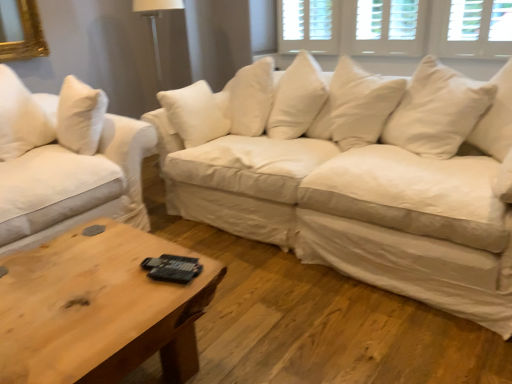
Question: Should I look upward or downward to see white cotton couch at center, which is counted as the 1th studio couch, starting from the right?

Choices:
 (A) down
 (B) up

Answer: (B)

Question: From a real-world perspective, is white cotton couch at left, which is counted as the 2th studio couch, starting from the right, located higher than white cotton couch at center, the 2th studio couch when ordered from left to right?

Choices:
 (A) yes
 (B) no

Answer: (A)

Question: Is white cotton couch at left, which is counted as the 2th studio couch, starting from the right, taller than white cotton couch at center, which is counted as the 1th studio couch, starting from the right?

Choices:
 (A) yes
 (B) no

Answer: (A)

Question: Is there a large distance between white cotton couch at left, the 1th studio couch in the left-to-right sequence, and white cotton couch at center, which is counted as the 1th studio couch, starting from the right?

Choices:
 (A) yes
 (B) no

Answer: (B)

Question: Does white cotton couch at left, which is counted as the 2th studio couch, starting from the right, turn towards white cotton couch at center, which is counted as the 1th studio couch, starting from the right?

Choices:
 (A) no
 (B) yes

Answer: (A)

Question: From the image's perspective, would you say white cotton couch at left, the 1th studio couch in the left-to-right sequence, is shown under white cotton couch at center, which is counted as the 1th studio couch, starting from the right?

Choices:
 (A) yes
 (B) no

Answer: (A)

Question: Does white cotton couch at left, the 1th studio couch in the left-to-right sequence, touch white cotton couch at center, which is counted as the 1th studio couch, starting from the right?

Choices:
 (A) no
 (B) yes

Answer: (A)

Question: Can you confirm if white cotton couch at center, which is counted as the 1th studio couch, starting from the right, is smaller than white cotton couch at left, which is counted as the 2th studio couch, starting from the right?

Choices:
 (A) no
 (B) yes

Answer: (A)

Question: From a real-world perspective, is white cotton couch at center, the 2th studio couch when ordered from left to right, physically below white cotton couch at left, the 1th studio couch in the left-to-right sequence?

Choices:
 (A) yes
 (B) no

Answer: (A)

Question: Considering the relative sizes of white cotton couch at center, the 2th studio couch when ordered from left to right, and white cotton couch at left, which is counted as the 2th studio couch, starting from the right, in the image provided, is white cotton couch at center, the 2th studio couch when ordered from left to right, thinner than white cotton couch at left, which is counted as the 2th studio couch, starting from the right,?

Choices:
 (A) yes
 (B) no

Answer: (A)

Question: Is white cotton couch at center, the 2th studio couch when ordered from left to right, closer to camera compared to white cotton couch at left, which is counted as the 2th studio couch, starting from the right?

Choices:
 (A) yes
 (B) no

Answer: (A)

Question: From the image's perspective, is white cotton couch at center, the 2th studio couch when ordered from left to right, under white cotton couch at left, the 1th studio couch in the left-to-right sequence?

Choices:
 (A) no
 (B) yes

Answer: (A)

Question: Can you confirm if white cotton couch at center, which is counted as the 1th studio couch, starting from the right, is taller than white cotton couch at left, which is counted as the 2th studio couch, starting from the right?

Choices:
 (A) yes
 (B) no

Answer: (B)

Question: Considering the relative sizes of white cotton couch at center, the 2th studio couch when ordered from left to right, and white wood window at upper center, the first window from the left, in the image provided, is white cotton couch at center, the 2th studio couch when ordered from left to right, thinner than white wood window at upper center, the first window from the left,?

Choices:
 (A) yes
 (B) no

Answer: (B)